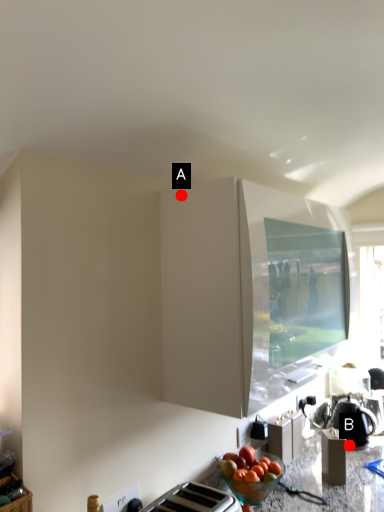
Question: Two points are circled on the image, labeled by A and B beside each circle. Which point is further to the camera?

Choices:
 (A) A is further
 (B) B is further

Answer: (B)